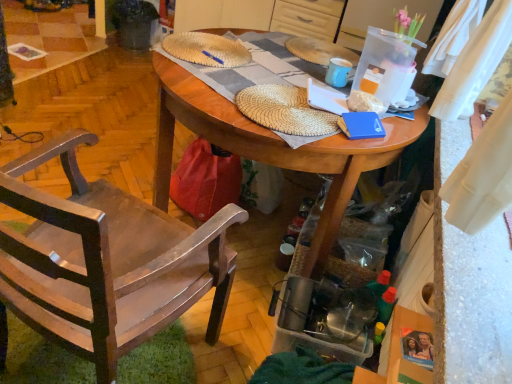
The height and width of the screenshot is (384, 512). Identify the location of vacant space that is to the left of matte blue mug at upper center. (293, 69).